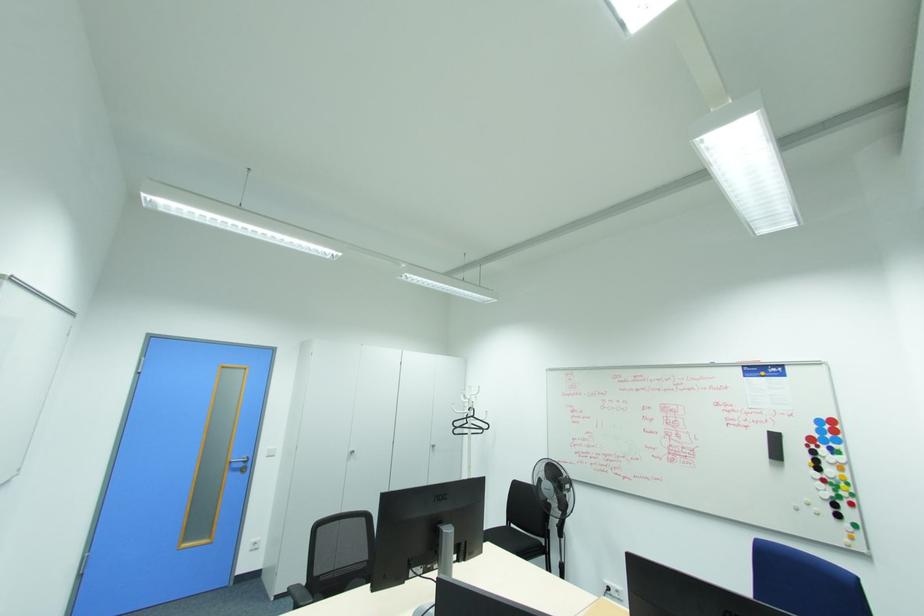
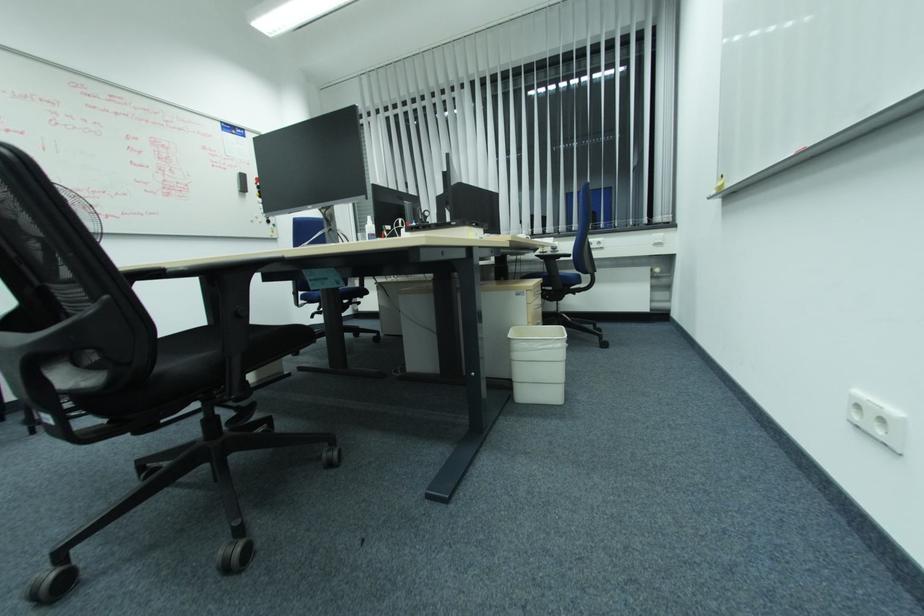
Find the pixel in the second image that matches [775,439] in the first image.

(244, 177)